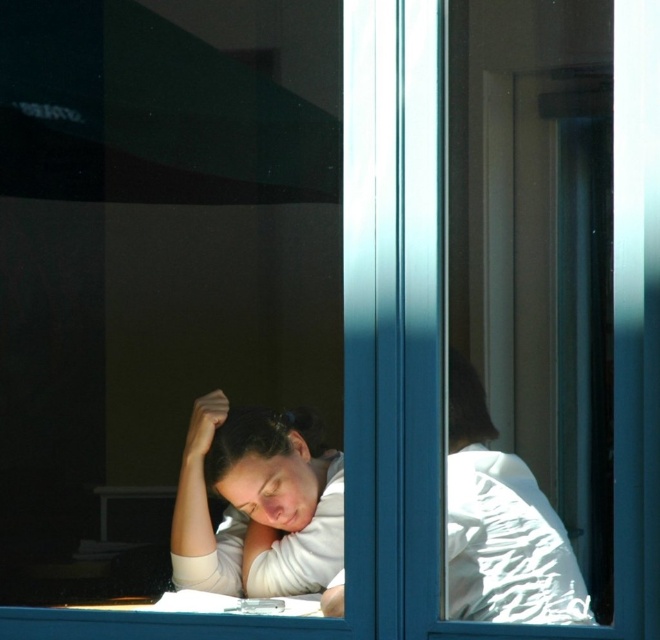
Question: Can you confirm if matte white shirt at center is bigger than smooth brown hair at center?

Choices:
 (A) no
 (B) yes

Answer: (B)

Question: Which point is closer to the camera?

Choices:
 (A) smooth brown hair at center
 (B) matte white head at lower center
 (C) white matte shirt at center
 (D) matte white shirt at center

Answer: (C)

Question: Which object is the closest to the white matte shirt at center?

Choices:
 (A) smooth brown hair at center
 (B) matte white shirt at center

Answer: (B)

Question: Which point appears closest to the camera in this image?

Choices:
 (A) (486, 406)
 (B) (306, 506)
 (C) (201, 444)

Answer: (A)

Question: Is the position of matte white head at lower center less distant than that of smooth brown hair at center?

Choices:
 (A) no
 (B) yes

Answer: (A)

Question: Can you confirm if matte white shirt at center is positioned to the right of white matte shirt at center?

Choices:
 (A) yes
 (B) no

Answer: (B)